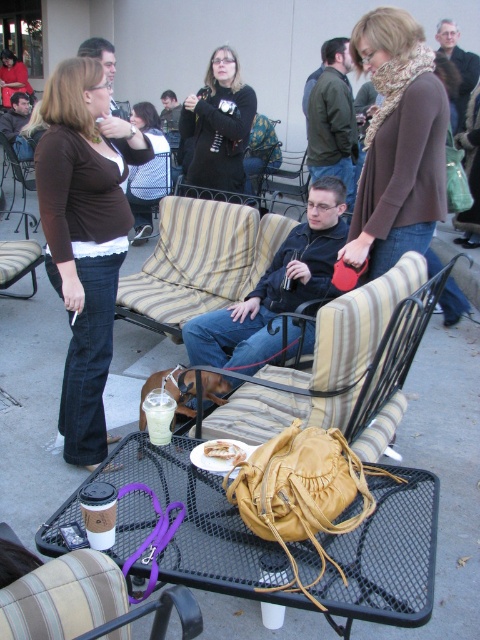
You are organizing a picnic basket and need to decide which item to pack first between the knit scarf at center and the white paper bag at center. Based on their sizes, which one should you choose?

The knit scarf at center is larger in size than the white paper bag at center, so you should pack the knit scarf at center first to ensure there is enough space for the smaller item afterward.

You are sitting at the black metal table with a mesh surface and want to reach both the yellow handbag with a drawstring closure and the disposable coffee cup with lid and straw. Which object is closer to you, the point representing the yellow handbag with a drawstring closure at point (399,125) or the point representing the disposable coffee cup with lid and straw at point (225,451)?

The point representing the yellow handbag with a drawstring closure at point (399,125) is closer to you because it is further to the viewer than the point representing the disposable coffee cup with lid and straw at point (225,451).